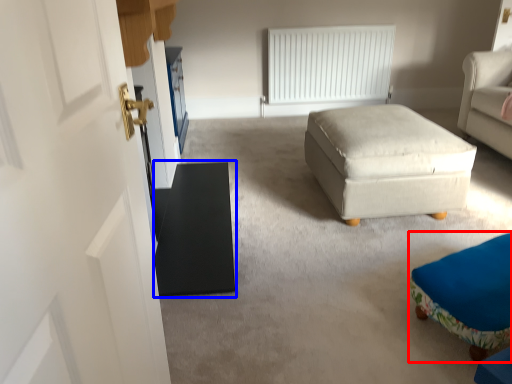
Question: Which of the following is the farthest to the observer, furniture (highlighted by a red box) or table (highlighted by a blue box)?

Choices:
 (A) furniture
 (B) table

Answer: (B)